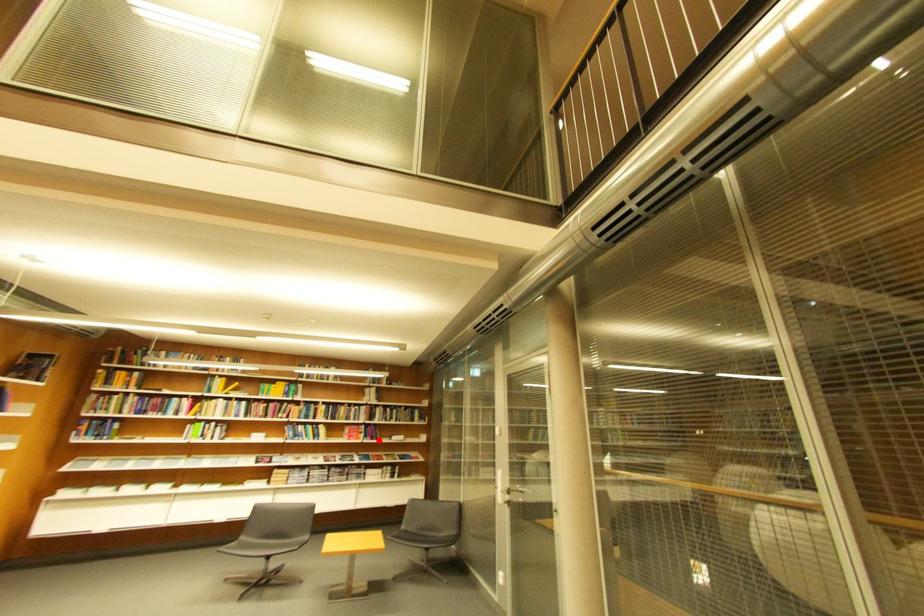
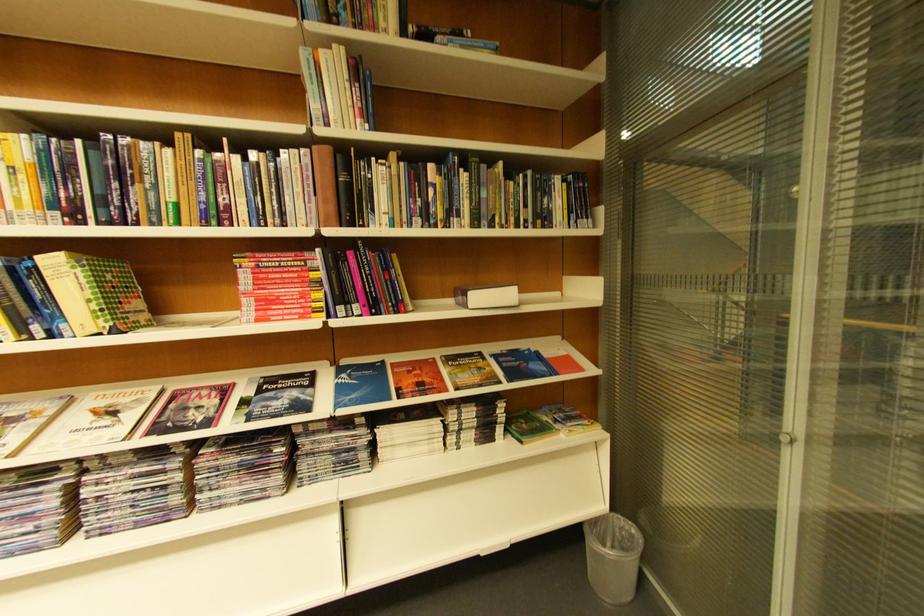
Find the pixel in the second image that matches the highlighted location in the first image.

(367, 310)